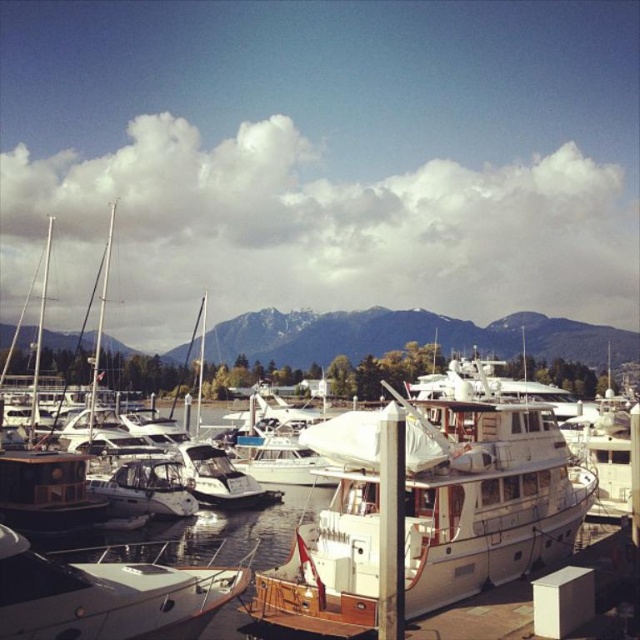
Can you confirm if white wood boat at center is smaller than white glossy boat at lower left?

No, white wood boat at center is not smaller than white glossy boat at lower left.

Is point (470, 556) positioned in front of point (38, 589)?

No, it is not.

Is point (349, 586) farther from viewer compared to point (76, 579)?

Yes, point (349, 586) is farther from viewer.

Image resolution: width=640 pixels, height=640 pixels. Identify the location of white wood boat at center. (483, 497).